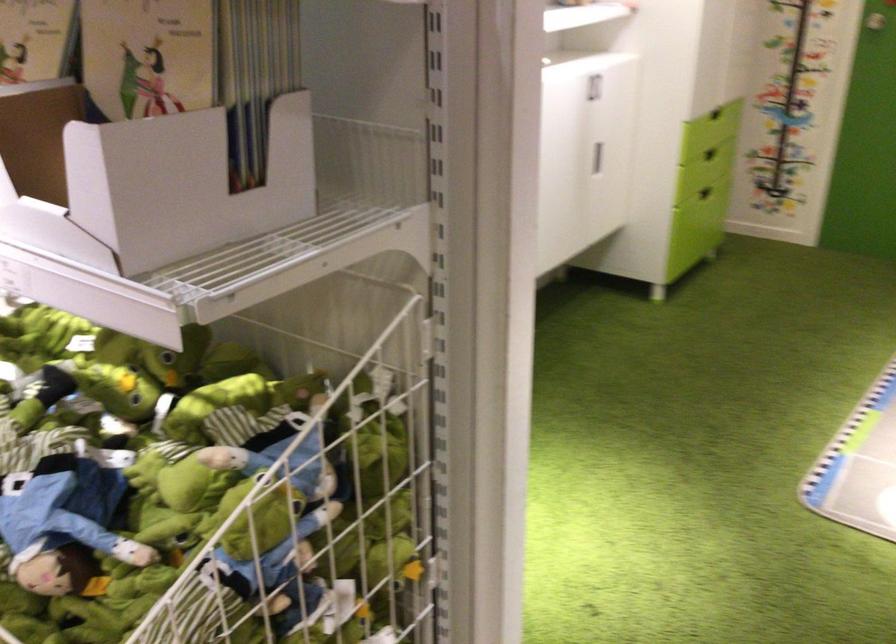
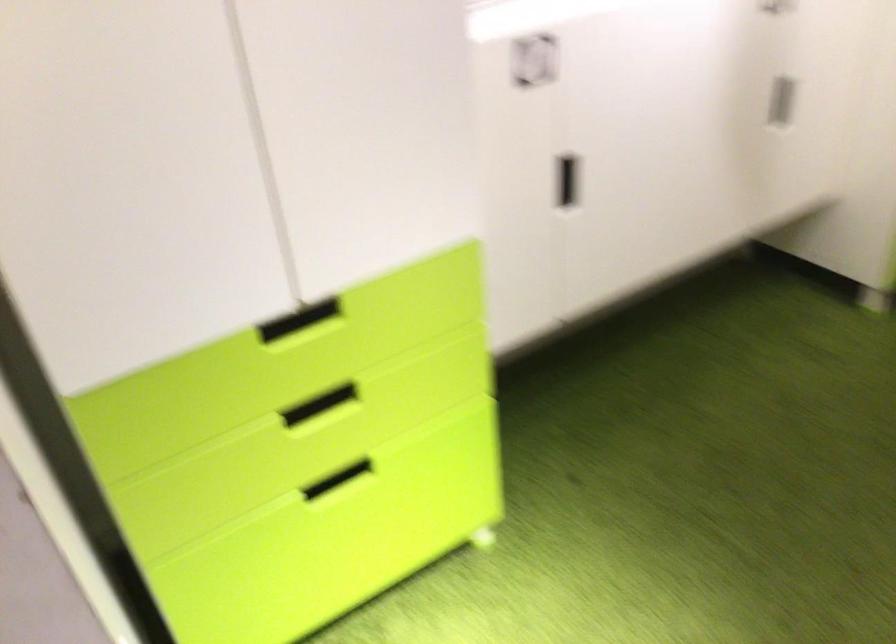
What movement of the cameraman would produce the second image?

The movement direction of the cameraman is right, forward.